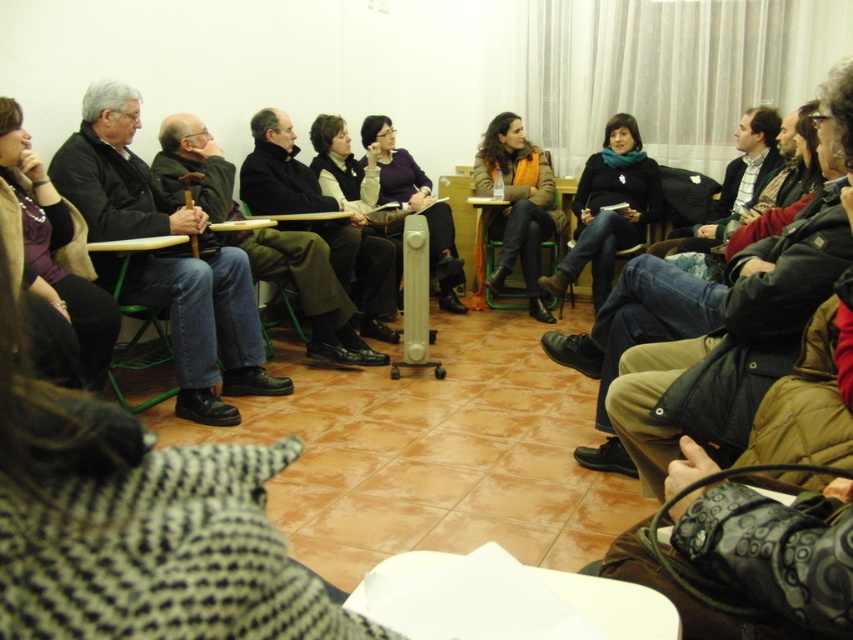
Question: Which point is farther to the camera?

Choices:
 (A) (363, 124)
 (B) (144, 406)
 (C) (527, 252)
 (D) (640, 184)

Answer: (A)

Question: From the image, what is the correct spatial relationship of orange knitted scarf at center in relation to matte purple sweater at center?

Choices:
 (A) right
 (B) left

Answer: (A)

Question: Is orange knitted scarf at center bigger than matte purple sweater at center?

Choices:
 (A) yes
 (B) no

Answer: (B)

Question: Considering the relative positions of matte black sweater at center and matte purple sweater at center in the image provided, where is matte black sweater at center located with respect to matte purple sweater at center?

Choices:
 (A) below
 (B) above

Answer: (A)

Question: Which object is positioned closest to the green plastic chair at left?

Choices:
 (A) matte black sweater at center
 (B) orange knitted scarf at center
 (C) matte purple sweater at center

Answer: (C)

Question: Which object is farther from the camera taking this photo?

Choices:
 (A) green plastic chair at left
 (B) orange knitted scarf at center
 (C) matte black sweater at center

Answer: (B)